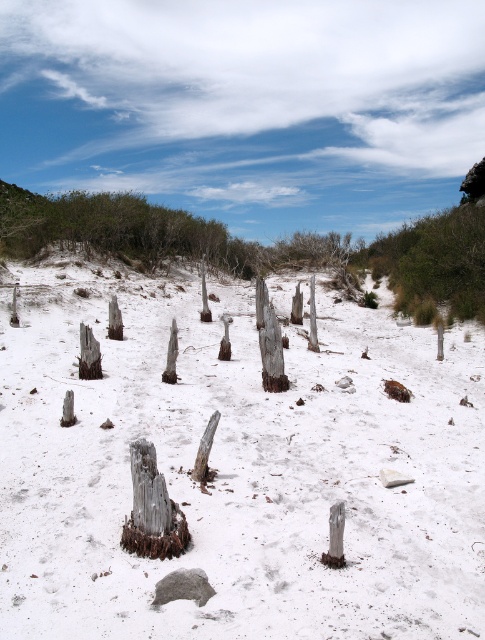
Is point (44, 456) behind point (272, 365)?

No, (44, 456) is in front of (272, 365).

Does white sandy beach at center appear under weathered wood tree trunk at center?

Correct, white sandy beach at center is located below weathered wood tree trunk at center.

Which is behind, point (25, 436) or point (261, 342)?

The point (261, 342) is more distant.

At what (x,y) coordinates should I click in order to perform the action: click on white sandy beach at center. Please return your answer as a coordinate pair (x, y). The image size is (485, 640). Looking at the image, I should click on (238, 468).